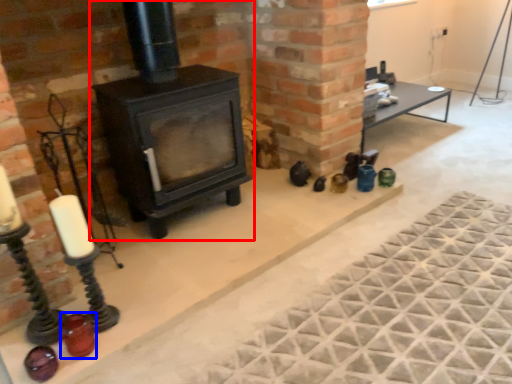
Question: Which of the following is the farthest to the observer, wood burning stove (highlighted by a red box) or candle holder (highlighted by a blue box)?

Choices:
 (A) wood burning stove
 (B) candle holder

Answer: (A)